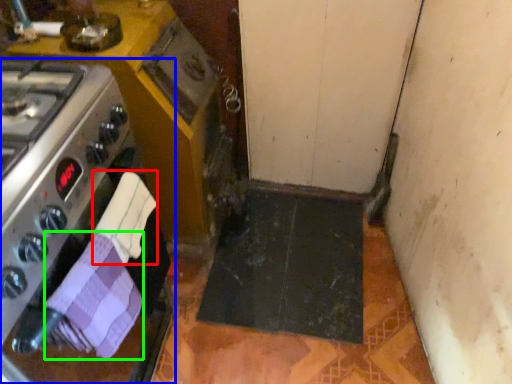
Question: Which object is the farthest from hand towel (highlighted by a red box)? Choose among these: kitchen appliance (highlighted by a blue box) or hand towel (highlighted by a green box).

Choices:
 (A) kitchen appliance
 (B) hand towel

Answer: (A)